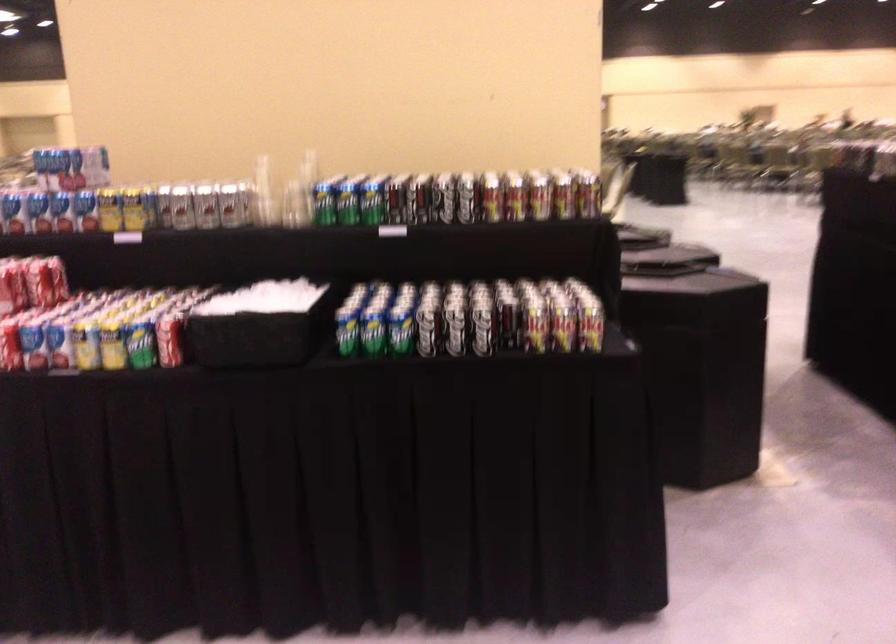
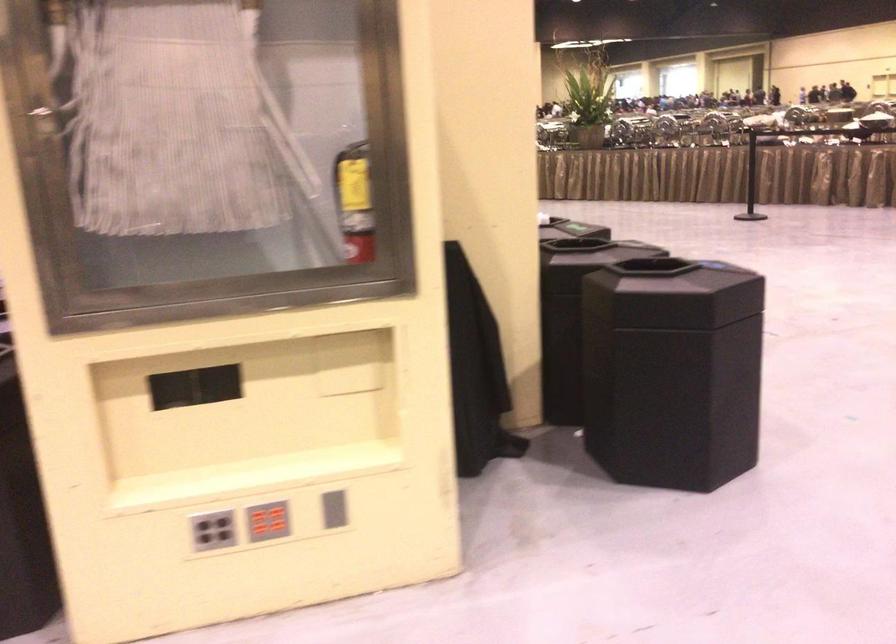
Question: I am providing you with two images of the same scene from different viewpoints. Which of the following objects are not visible in image2?

Choices:
 (A) red button panel
 (B) black trash can lid
 (C) white paper packet
 (D) silver soda can

Answer: (D)